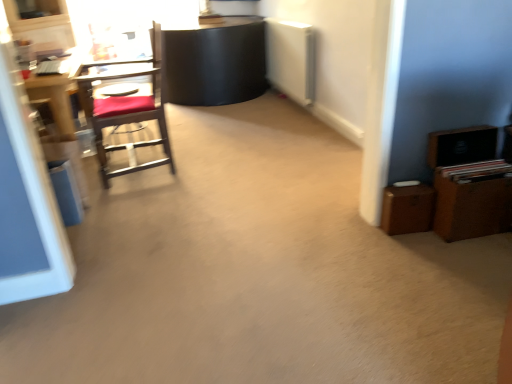
This screenshot has height=384, width=512. I want to click on vacant space situated on the left part of brown wooden dresser at right, so click(402, 246).